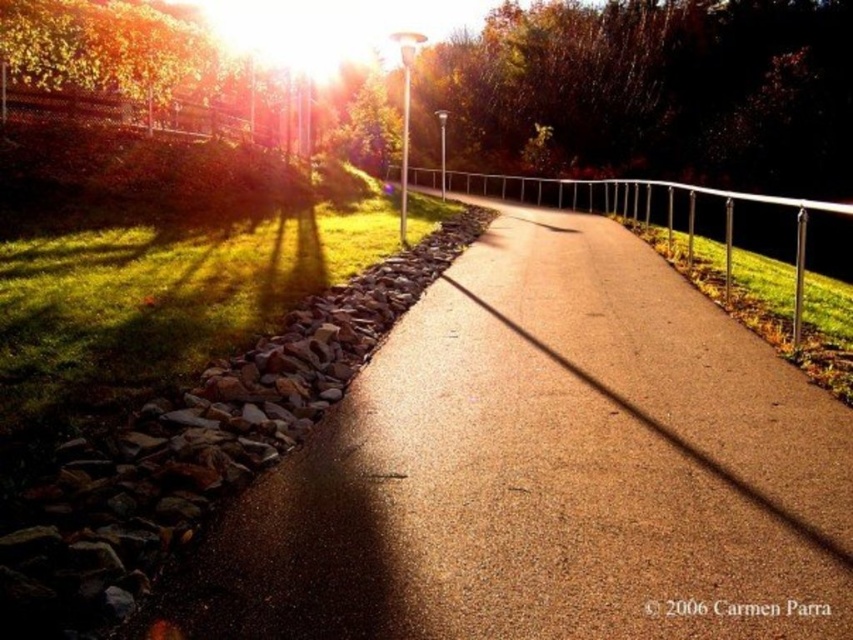
Who is taller, smooth asphalt road at center or silver metallic fence at center?

silver metallic fence at center

The width and height of the screenshot is (853, 640). What do you see at coordinates (544, 472) in the screenshot?
I see `smooth asphalt road at center` at bounding box center [544, 472].

Image resolution: width=853 pixels, height=640 pixels. In order to click on smooth asphalt road at center in this screenshot , I will do `click(544, 472)`.

This screenshot has height=640, width=853. I want to click on smooth asphalt road at center, so click(x=544, y=472).

Can you confirm if smooth asphalt road at center is shorter than brown rough stones at lower left?

Incorrect, smooth asphalt road at center's height does not fall short of brown rough stones at lower left's.

From the picture: Who is more forward, (462, 433) or (74, 522)?

Point (74, 522) is in front.

Where is `smooth asphalt road at center`? The width and height of the screenshot is (853, 640). smooth asphalt road at center is located at coordinates (544, 472).

At what (x,y) coordinates should I click in order to perform the action: click on smooth asphalt road at center. Please return your answer as a coordinate pair (x, y). This screenshot has height=640, width=853. Looking at the image, I should click on (544, 472).

Is brown rough stones at lower left to the right of silver metallic fence at center from the viewer's perspective?

No, brown rough stones at lower left is not to the right of silver metallic fence at center.

The height and width of the screenshot is (640, 853). What do you see at coordinates (194, 451) in the screenshot? I see `brown rough stones at lower left` at bounding box center [194, 451].

Locate an element on the screen. The width and height of the screenshot is (853, 640). brown rough stones at lower left is located at coordinates (194, 451).